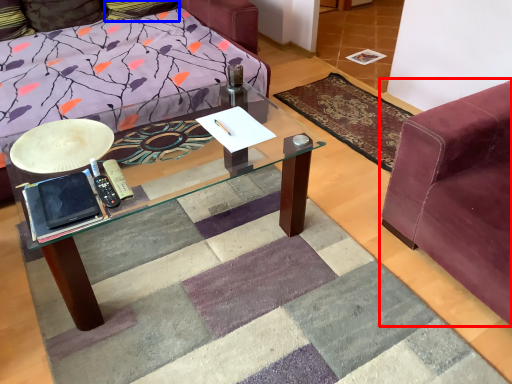
Question: Which of the following is the closest to the observer, studio couch (highlighted by a red box) or pillow (highlighted by a blue box)?

Choices:
 (A) studio couch
 (B) pillow

Answer: (A)